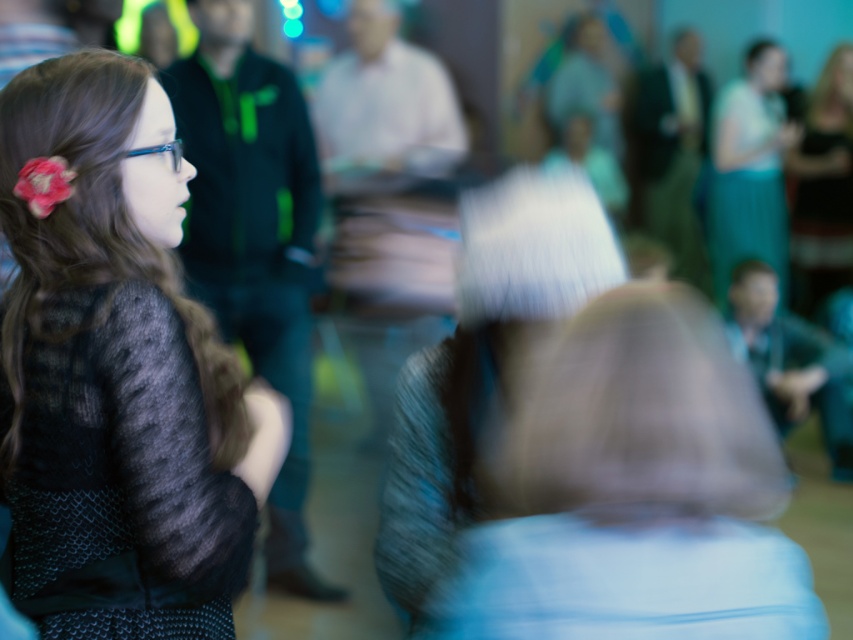
Consider the image. Is knitted sweater at left to the left of dark brown leather jacket at upper right from the viewer's perspective?

Yes, knitted sweater at left is to the left of dark brown leather jacket at upper right.

Identify the location of knitted sweater at left. This screenshot has width=853, height=640. (120, 340).

This screenshot has height=640, width=853. I want to click on knitted sweater at left, so [120, 340].

Between point (776, 54) and point (822, 292), which one is positioned behind?

The point (776, 54) is more distant.

This screenshot has height=640, width=853. In order to click on teal fabric dress at upper right in this screenshot , I will do `click(749, 170)`.

Measure the distance between point (759, 65) and camera.

Point (759, 65) and camera are 22.61 feet apart.

Where is `teal fabric dress at upper right`? The height and width of the screenshot is (640, 853). teal fabric dress at upper right is located at coordinates (749, 170).

Who is shorter, knitted sweater at left or teal fabric dress at upper right?

Standing shorter between the two is knitted sweater at left.

Which of these two, knitted sweater at left or teal fabric dress at upper right, stands taller?

teal fabric dress at upper right

Locate an element on the screen. knitted sweater at left is located at coordinates (120, 340).